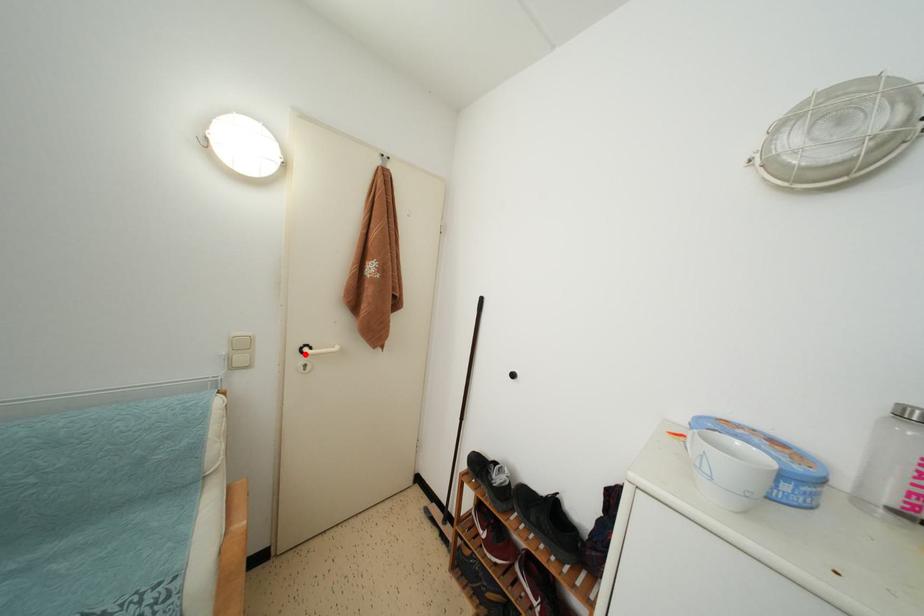
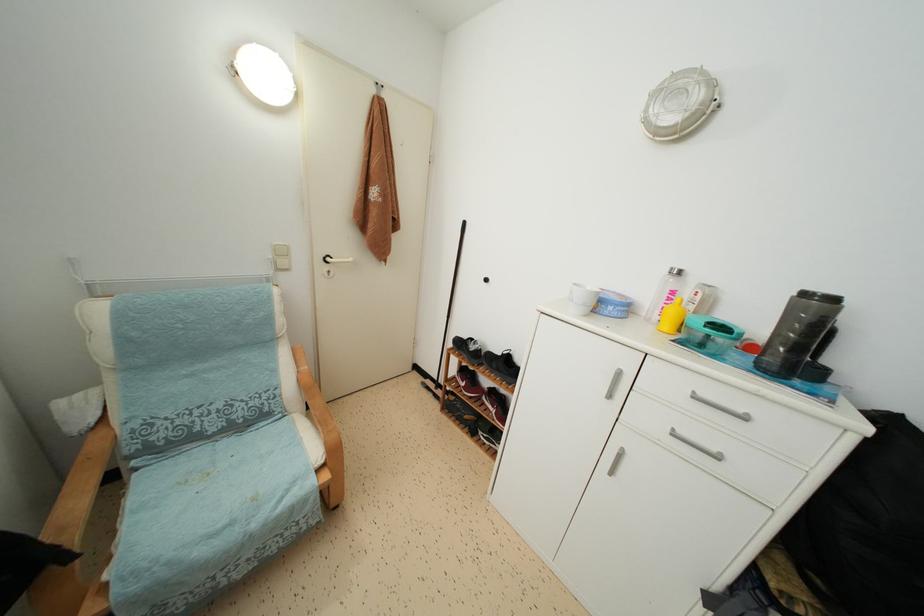
In the second image, find the point that corresponds to the highlighted location in the first image.

(329, 264)